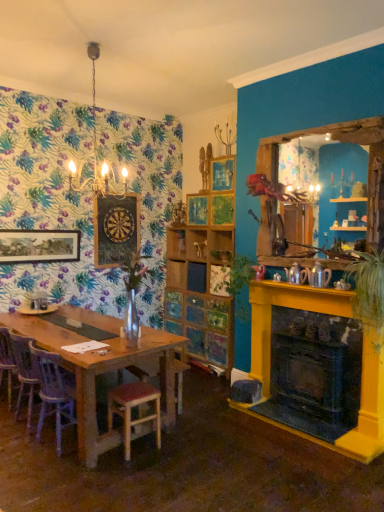
Question: Is white porcelain plate at left in front of or behind green leafy plant at center, marked as the 1th plant in a back-to-front arrangement, in the image?

Choices:
 (A) front
 (B) behind

Answer: (B)

Question: In terms of size, does white porcelain plate at left appear bigger or smaller than green leafy plant at center, marked as the first plant in a left-to-right arrangement?

Choices:
 (A) small
 (B) big

Answer: (A)

Question: Based on their relative distances, which object is nearer to the white porcelain plate at left?

Choices:
 (A) matte black picture frame at upper left, which is counted as the 2th picture frame, starting from the right
 (B) green leafy plant at right, arranged as the 1th plant when viewed from the front
 (C) metallic chandelier at upper center
 (D) wooden at left, acting as the first chair starting from the back
 (E) green leafy plant at center, marked as the first plant in a left-to-right arrangement

Answer: (D)

Question: Which of these objects is positioned closest to the wooden shelf at center?

Choices:
 (A) wooden mirror at right
 (B) metallic yellow fireplace at right
 (C) metallic chandelier at upper center
 (D) wooden dartboard at upper left, the 1th picture frame in the right-to-left sequence
 (E) pine wood stool at lower left

Answer: (C)